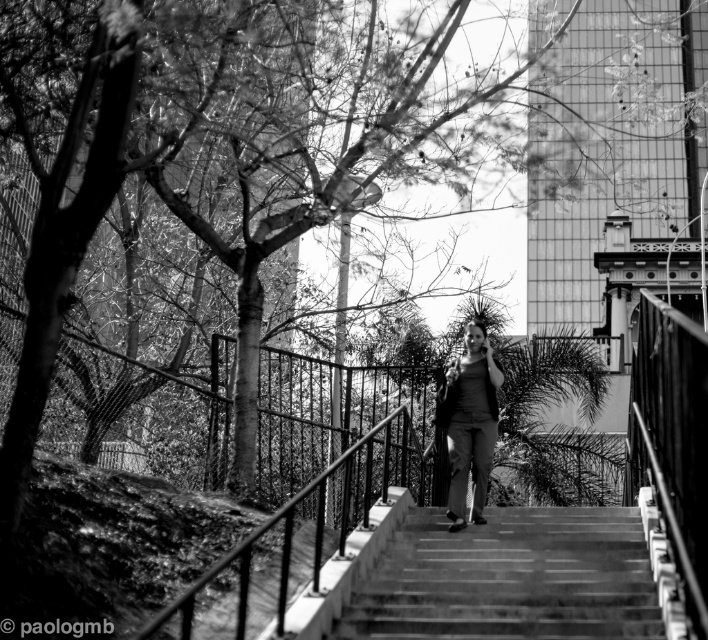
You are a delivery person carrying a package and need to pass through the area between the smooth metal railing at center and the matte gray pants at center. The package is 8 meters long. Can you fit the package through the space between them?

The smooth metal railing at center and the matte gray pants at center are 7.82 meters apart, so the package cannot fit through the space since it is longer than the available distance.

You are a photographer trying to capture the matte gray pants at center and the smooth concrete stairs at center in a single shot. Based on their positions, which object should you focus on first to ensure both are in frame?

The smooth concrete stairs at center is positioned under matte gray pants at center, so you should focus on the matte gray pants at center first to ensure both are in frame.

You are standing at the bottom of the smooth concrete stairs at center and want to reach the person wearing matte gray pants at center. Which direction should you move to get closer to them?

The smooth concrete stairs at center is in front of matte gray pants at center, so you should move forward along the stairs to get closer to the person wearing matte gray pants at center.